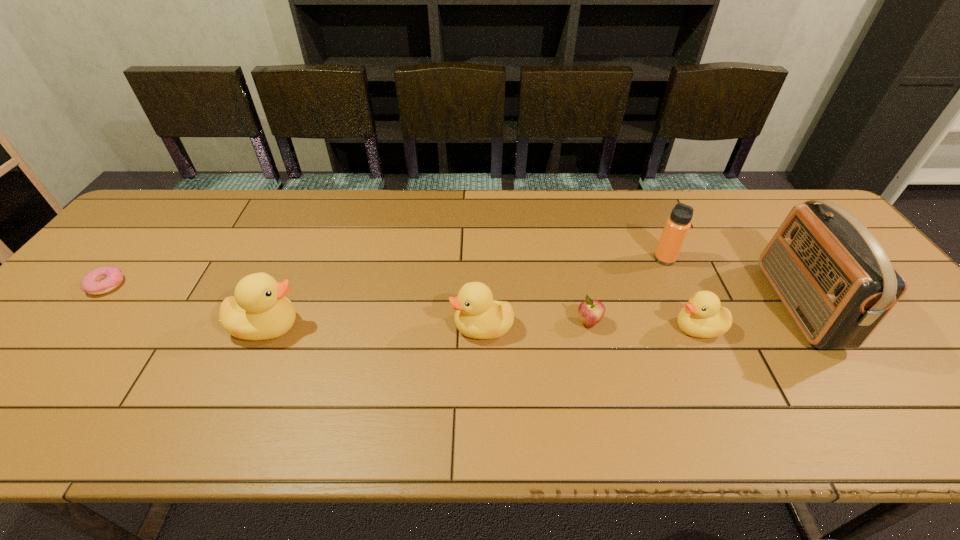
Identify the location of the sixth object from right to left. (259, 310).

Find the location of a particular element. The height and width of the screenshot is (540, 960). the fifth object from right to left is located at coordinates (478, 316).

Identify the location of the fourth tallest object. The height and width of the screenshot is (540, 960). (478, 316).

Where is `the shortest duckling`? The image size is (960, 540). the shortest duckling is located at coordinates (702, 317).

At what (x,y) coordinates should I click in order to perform the action: click on the third shortest object. Please return your answer as a coordinate pair (x, y). This screenshot has width=960, height=540. Looking at the image, I should click on (702, 317).

This screenshot has height=540, width=960. I want to click on thermos bottle, so click(676, 228).

Identify the location of the leftmost object. Image resolution: width=960 pixels, height=540 pixels. (102, 280).

Locate an element on the screen. The width and height of the screenshot is (960, 540). doughnut is located at coordinates (102, 280).

Locate an element on the screen. Image resolution: width=960 pixels, height=540 pixels. radio receiver is located at coordinates (831, 273).

The width and height of the screenshot is (960, 540). Identify the location of the tallest object. (831, 273).